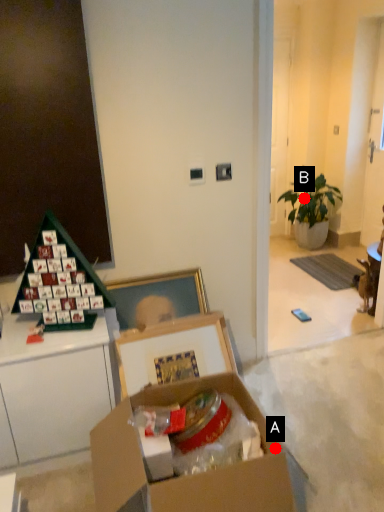
Question: Two points are circled on the image, labeled by A and B beside each circle. Among these points, which one is farthest from the camera?

Choices:
 (A) A is further
 (B) B is further

Answer: (B)